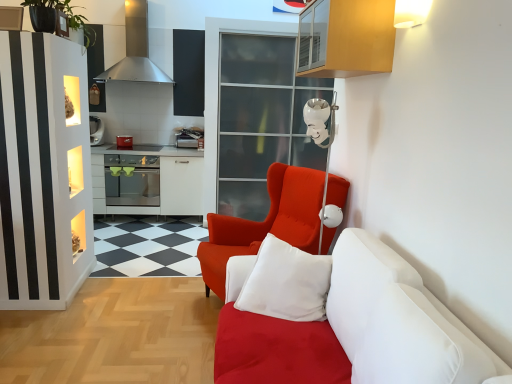
Question: Can you confirm if white soft cushion at center is taller than stainless steel exhaust hood at upper left?

Choices:
 (A) yes
 (B) no

Answer: (B)

Question: Could stainless steel exhaust hood at upper left be considered to be inside white soft cushion at center?

Choices:
 (A) yes
 (B) no

Answer: (B)

Question: Considering the relative sizes of white soft cushion at center and stainless steel exhaust hood at upper left in the image provided, is white soft cushion at center bigger than stainless steel exhaust hood at upper left?

Choices:
 (A) yes
 (B) no

Answer: (B)

Question: Would you say white soft cushion at center is a long distance from stainless steel exhaust hood at upper left?

Choices:
 (A) yes
 (B) no

Answer: (A)

Question: Is white soft cushion at center facing away from stainless steel exhaust hood at upper left?

Choices:
 (A) yes
 (B) no

Answer: (B)

Question: Considering the positions of point (138, 192) and point (308, 168), is point (138, 192) closer or farther from the camera than point (308, 168)?

Choices:
 (A) closer
 (B) farther

Answer: (B)

Question: Considering the positions of satin silver oven at center and satin red armchair at center in the image, is satin silver oven at center bigger or smaller than satin red armchair at center?

Choices:
 (A) small
 (B) big

Answer: (A)

Question: From the image's perspective, is satin silver oven at center positioned above or below satin red armchair at center?

Choices:
 (A) below
 (B) above

Answer: (B)

Question: Considering the positions of satin silver oven at center and satin red armchair at center in the image, is satin silver oven at center wider or thinner than satin red armchair at center?

Choices:
 (A) wide
 (B) thin

Answer: (B)

Question: Is stainless steel exhaust hood at upper left wider or thinner than stainless steel oven at left?

Choices:
 (A) thin
 (B) wide

Answer: (A)

Question: Considering their positions, is stainless steel exhaust hood at upper left located in front of or behind stainless steel oven at left?

Choices:
 (A) front
 (B) behind

Answer: (A)

Question: Is stainless steel exhaust hood at upper left spatially inside stainless steel oven at left, or outside of it?

Choices:
 (A) inside
 (B) outside

Answer: (B)

Question: Is stainless steel exhaust hood at upper left to the left or to the right of stainless steel oven at left in the image?

Choices:
 (A) left
 (B) right

Answer: (A)

Question: Is stainless steel exhaust hood at upper left to the left or to the right of transparent glass door at upper center in the image?

Choices:
 (A) right
 (B) left

Answer: (B)

Question: In terms of width, does stainless steel exhaust hood at upper left look wider or thinner when compared to transparent glass door at upper center?

Choices:
 (A) wide
 (B) thin

Answer: (B)